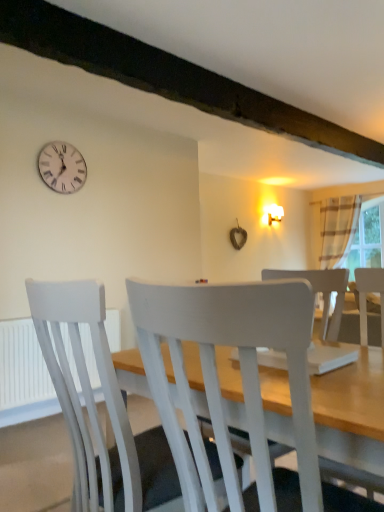
Question: Is white painted wood chair at center, which appears as the second chair when viewed from the back, oriented towards white plastic clock at upper left?

Choices:
 (A) no
 (B) yes

Answer: (A)

Question: Can you confirm if white painted wood chair at center, the 1th chair in the front-to-back sequence, is bigger than white plastic clock at upper left?

Choices:
 (A) no
 (B) yes

Answer: (B)

Question: Does white painted wood chair at center, which appears as the second chair when viewed from the back, come behind white plastic clock at upper left?

Choices:
 (A) no
 (B) yes

Answer: (A)

Question: Is white painted wood chair at center, the 1th chair in the front-to-back sequence, at the left side of white plastic clock at upper left?

Choices:
 (A) no
 (B) yes

Answer: (A)

Question: From the image's perspective, is white painted wood chair at center, the 1th chair in the front-to-back sequence, above white plastic clock at upper left?

Choices:
 (A) yes
 (B) no

Answer: (B)

Question: Is white painted wood chair at center, the 1th chair in the front-to-back sequence, not within white plastic clock at upper left?

Choices:
 (A) yes
 (B) no

Answer: (A)

Question: Is clear glass window at right oriented towards striped fabric curtain at right?

Choices:
 (A) no
 (B) yes

Answer: (B)

Question: Is clear glass window at right positioned with its back to striped fabric curtain at right?

Choices:
 (A) yes
 (B) no

Answer: (A)

Question: Does clear glass window at right lie behind striped fabric curtain at right?

Choices:
 (A) no
 (B) yes

Answer: (B)

Question: Is clear glass window at right to the left of striped fabric curtain at right from the viewer's perspective?

Choices:
 (A) yes
 (B) no

Answer: (B)

Question: Is clear glass window at right positioned beyond the bounds of striped fabric curtain at right?

Choices:
 (A) yes
 (B) no

Answer: (A)

Question: From a real-world perspective, is clear glass window at right physically below striped fabric curtain at right?

Choices:
 (A) no
 (B) yes

Answer: (B)

Question: Is white painted wood chair at center, placed as the second chair when sorted from front to back, not close to white plastic clock at upper left?

Choices:
 (A) no
 (B) yes

Answer: (B)